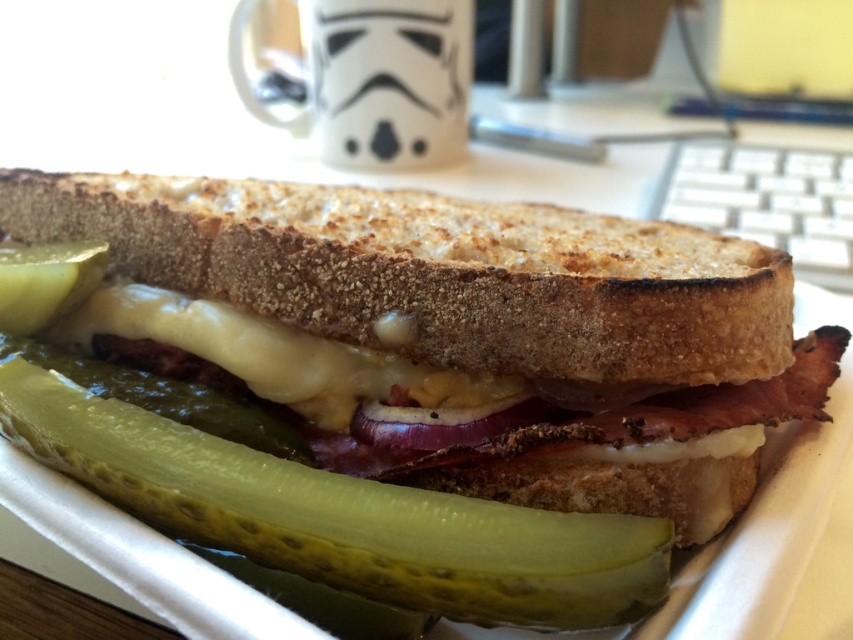
You are a food delivery robot with a camera mounted at a height of 1 meter. You need to pick up the green pickled vegetable at center from the plate. Based on the distance between the vegetable and your camera, can you safely reach it without knocking over the white mug with black helmet design nearby?

The green pickled vegetable at center is 65.19 centimeters away from the camera. Since the robot has a camera at 1 meter height, it can safely reach the vegetable as the distance is sufficient and the mug is out of the way.

You are a food critic examining the sandwich on the plate. From your perspective, which ingredient is closer to you between the toasted bread at center and the white melted cheese at center?

The toasted bread at center is closer to the viewer than the white melted cheese at center.

Looking at the sandwich on the plate, where is the green pickled vegetable at center in relation to the white melted cheese at center?

The green pickled vegetable at center is to the right of the white melted cheese at center.